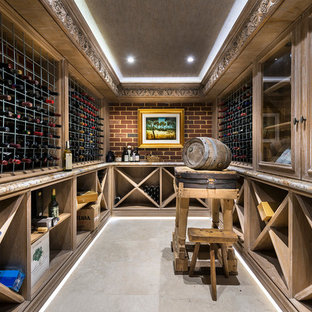
Locate an element on the screen. This screenshot has width=312, height=312. table is located at coordinates (186, 170).